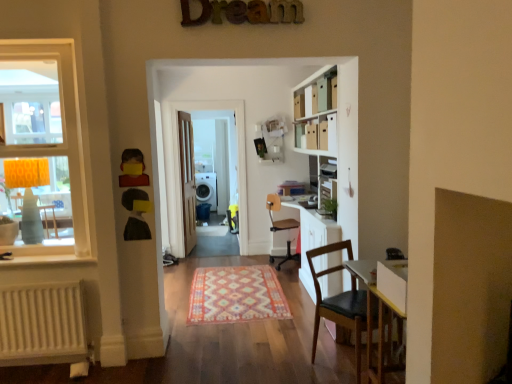
Question: Can you confirm if white glossy door at center is shorter than white plastic speaker at center?

Choices:
 (A) no
 (B) yes

Answer: (A)

Question: Considering the relative positions of white glossy door at center and white plastic speaker at center in the image provided, is white glossy door at center to the left of white plastic speaker at center from the viewer's perspective?

Choices:
 (A) no
 (B) yes

Answer: (A)

Question: Would you say white glossy door at center is outside white plastic speaker at center?

Choices:
 (A) yes
 (B) no

Answer: (A)

Question: Does white glossy door at center come in front of white plastic speaker at center?

Choices:
 (A) no
 (B) yes

Answer: (B)

Question: From a real-world perspective, is white glossy door at center positioned over white plastic speaker at center based on gravity?

Choices:
 (A) no
 (B) yes

Answer: (B)

Question: In the image, is white matte radiator at lower left on the left side or the right side of wooden at center, which ranks as the second chair in front-to-back order?

Choices:
 (A) right
 (B) left

Answer: (B)

Question: In terms of size, does white matte radiator at lower left appear bigger or smaller than wooden at center, which ranks as the second chair in front-to-back order?

Choices:
 (A) small
 (B) big

Answer: (A)

Question: Is white matte radiator at lower left in front of or behind wooden at center, the first chair in the back-to-front sequence, in the image?

Choices:
 (A) behind
 (B) front

Answer: (B)

Question: Considering the positions of point (42, 307) and point (293, 254), is point (42, 307) closer or farther from the camera than point (293, 254)?

Choices:
 (A) closer
 (B) farther

Answer: (A)

Question: From their relative heights in the image, would you say white matte bookcase at center is taller or shorter than matte yellow lampshade at left?

Choices:
 (A) tall
 (B) short

Answer: (A)

Question: Is white matte bookcase at center wider or thinner than matte yellow lampshade at left?

Choices:
 (A) wide
 (B) thin

Answer: (A)

Question: Is white matte bookcase at center inside the boundaries of matte yellow lampshade at left, or outside?

Choices:
 (A) outside
 (B) inside

Answer: (A)

Question: Looking at the image, does white matte bookcase at center seem bigger or smaller compared to matte yellow lampshade at left?

Choices:
 (A) big
 (B) small

Answer: (A)

Question: In terms of size, does multicolored woven rug at center appear bigger or smaller than wooden at center, which ranks as the second chair in front-to-back order?

Choices:
 (A) small
 (B) big

Answer: (A)

Question: Considering the positions of multicolored woven rug at center and wooden at center, the first chair in the back-to-front sequence, in the image, is multicolored woven rug at center taller or shorter than wooden at center, the first chair in the back-to-front sequence,?

Choices:
 (A) tall
 (B) short

Answer: (B)